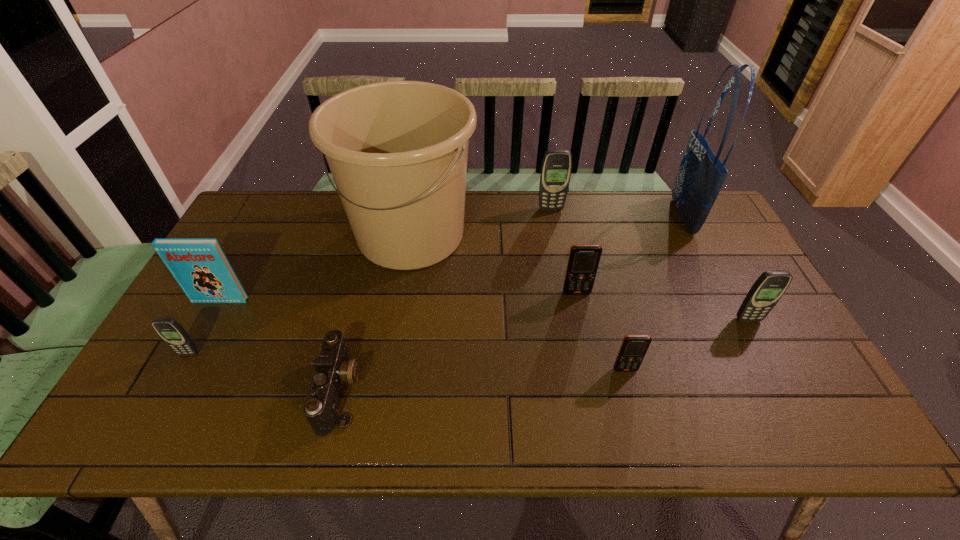
Image resolution: width=960 pixels, height=540 pixels. In the image, there is a desktop. Find the location of `vacant space at the far right corner`. vacant space at the far right corner is located at coordinates (676, 207).

The height and width of the screenshot is (540, 960). What are the coordinates of `free spot between the farthest gray cellular telephone and the shopping bag` in the screenshot? It's located at 616,213.

I want to click on free space between the rightmost gray cellular telephone and the shortest object, so click(x=544, y=355).

Find the location of a particular element. The width and height of the screenshot is (960, 540). vacant space that's between the eighth shortest object and the shortest object is located at coordinates (375, 313).

The height and width of the screenshot is (540, 960). I want to click on empty space between the nearer orange cellular telephone and the second farthest cellular telephone, so click(x=601, y=331).

In order to click on free spot between the fourth nearest object and the left orange cellular telephone in this screenshot , I will do pyautogui.click(x=662, y=306).

This screenshot has width=960, height=540. Find the location of `unoccupied position between the fifth nearest object and the second nearest cellular telephone`. unoccupied position between the fifth nearest object and the second nearest cellular telephone is located at coordinates (204, 327).

Identify the location of free spot between the nearest gray cellular telephone and the fifth nearest object. (204, 327).

The image size is (960, 540). I want to click on vacant space in between the fifth farthest object and the third nearest cellular telephone, so click(x=484, y=310).

Where is `vacant space that is in between the second tallest object and the tallest cellular telephone`? The width and height of the screenshot is (960, 540). vacant space that is in between the second tallest object and the tallest cellular telephone is located at coordinates tap(481, 222).